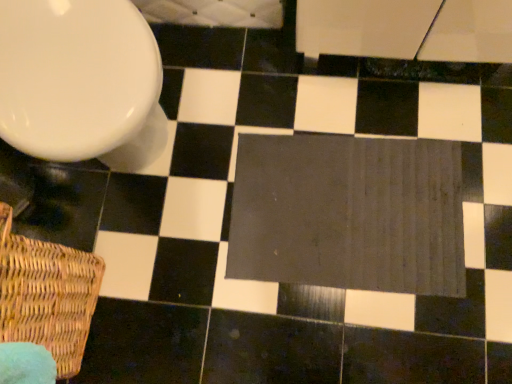
Find the location of a particular element. The height and width of the screenshot is (384, 512). vacant space in front of white glossy toilet at upper left is located at coordinates (160, 262).